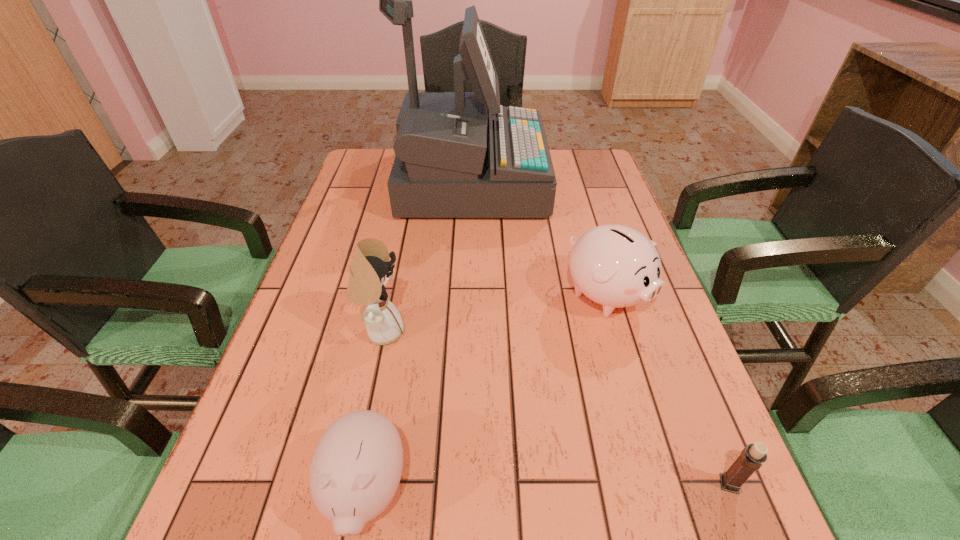
Where is `vacant region between the cash register and the candle holder`? This screenshot has width=960, height=540. vacant region between the cash register and the candle holder is located at coordinates (599, 333).

The height and width of the screenshot is (540, 960). Find the location of `vacant point located between the doll and the right piggy bank`. vacant point located between the doll and the right piggy bank is located at coordinates (493, 313).

This screenshot has width=960, height=540. Find the location of `the closest object to the farthest object`. the closest object to the farthest object is located at coordinates (616, 266).

At what (x,y) coordinates should I click in order to perform the action: click on object that is the second closest to the doll. Please return your answer as a coordinate pair (x, y). This screenshot has height=540, width=960. Looking at the image, I should click on (452, 160).

The width and height of the screenshot is (960, 540). I want to click on free space that satisfies the following two spatial constraints: 1. at the front face of the second tallest object; 2. on the right side of the candle holder, so click(348, 484).

Identify the location of vacant space that satisfies the following two spatial constraints: 1. on the back side of the right piggy bank; 2. on the customer-facing side of the tallest object. The width and height of the screenshot is (960, 540). (572, 181).

Where is `vacant space that satisfies the following two spatial constraints: 1. on the customer-facing side of the farther piggy bank; 2. on the right side of the farthest object`? The height and width of the screenshot is (540, 960). vacant space that satisfies the following two spatial constraints: 1. on the customer-facing side of the farther piggy bank; 2. on the right side of the farthest object is located at coordinates (466, 295).

What are the coordinates of `free region that satisfies the following two spatial constraints: 1. on the customer-facing side of the tallest object; 2. on the left side of the farther piggy bank` in the screenshot? It's located at (466, 295).

I want to click on free space that satisfies the following two spatial constraints: 1. on the customer-facing side of the third shortest object; 2. on the right side of the tallest object, so click(x=466, y=295).